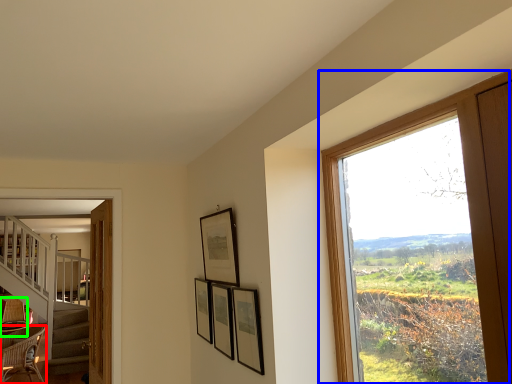
Question: Estimate the real-world distances between objects in this image. Which object is farther from chair (highlighted by a red box), window (highlighted by a blue box) or armchair (highlighted by a green box)?

Choices:
 (A) window
 (B) armchair

Answer: (A)